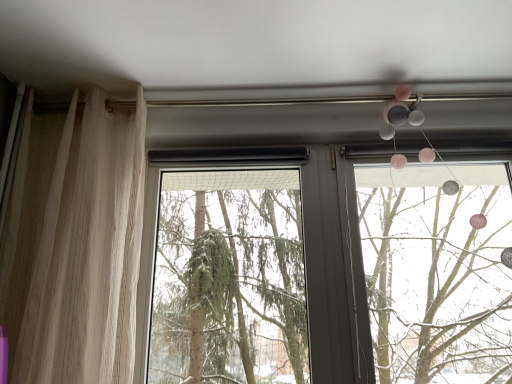
Question: Does matte plastic mobile at upper right touch green matte tree at center?

Choices:
 (A) no
 (B) yes

Answer: (A)

Question: Is matte plastic mobile at upper right shorter than green matte tree at center?

Choices:
 (A) yes
 (B) no

Answer: (B)

Question: From the image's perspective, is matte plastic mobile at upper right on top of green matte tree at center?

Choices:
 (A) no
 (B) yes

Answer: (B)

Question: Is matte plastic mobile at upper right in front of green matte tree at center?

Choices:
 (A) no
 (B) yes

Answer: (B)

Question: Considering the relative sizes of matte plastic mobile at upper right and green matte tree at center in the image provided, is matte plastic mobile at upper right taller than green matte tree at center?

Choices:
 (A) no
 (B) yes

Answer: (B)

Question: Is matte plastic mobile at upper right turned away from green matte tree at center?

Choices:
 (A) no
 (B) yes

Answer: (A)

Question: Considering the relative sizes of green matte tree at center and matte plastic mobile at upper right in the image provided, is green matte tree at center thinner than matte plastic mobile at upper right?

Choices:
 (A) yes
 (B) no

Answer: (B)

Question: Would you say green matte tree at center is outside matte plastic mobile at upper right?

Choices:
 (A) yes
 (B) no

Answer: (A)

Question: From a real-world perspective, is green matte tree at center over matte plastic mobile at upper right?

Choices:
 (A) yes
 (B) no

Answer: (B)

Question: Does green matte tree at center have a greater height compared to matte plastic mobile at upper right?

Choices:
 (A) yes
 (B) no

Answer: (B)

Question: Can you confirm if green matte tree at center is bigger than matte plastic mobile at upper right?

Choices:
 (A) yes
 (B) no

Answer: (B)

Question: Is green matte tree at center shorter than matte plastic mobile at upper right?

Choices:
 (A) no
 (B) yes

Answer: (B)

Question: From a real-world perspective, is sheer beige curtain at left located higher than green matte tree at center?

Choices:
 (A) no
 (B) yes

Answer: (B)